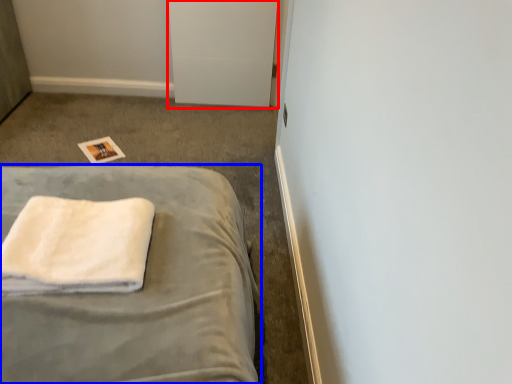
Question: Which object is closer to the camera taking this photo, file cabinet (highlighted by a red box) or bed (highlighted by a blue box)?

Choices:
 (A) file cabinet
 (B) bed

Answer: (B)